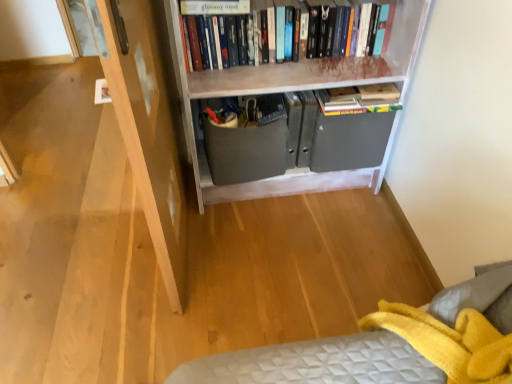
This screenshot has height=384, width=512. What are the coordinates of `hardcover book at upper center` in the screenshot? It's located at (214, 7).

Find the location of a particular element. hardcover books at upper center is located at coordinates (237, 34).

The width and height of the screenshot is (512, 384). What do you see at coordinates (237, 34) in the screenshot? I see `hardcover books at upper center` at bounding box center [237, 34].

What is the approximate width of white painted wood bookcase at upper center?

15.35 inches.

At what (x,y) coordinates should I click in order to perform the action: click on matte gray drawer at center. Please return your answer as a coordinate pair (x, y). Looking at the image, I should click on (244, 151).

At what (x,y) coordinates should I click in order to perform the action: click on hardcover book at upper center. Please return your answer as a coordinate pair (x, y). This screenshot has height=384, width=512. Looking at the image, I should click on (214, 7).

Between hardcover book at upper center and hardcover books at upper center, which one has more height?

Standing taller between the two is hardcover books at upper center.

Is the depth of hardcover book at upper center greater than that of hardcover books at upper center?

No, it is in front of hardcover books at upper center.

Is hardcover book at upper center looking in the opposite direction of hardcover books at upper center?

hardcover book at upper center is not turned away from hardcover books at upper center.

What's the angular difference between hardcover book at upper center and hardcover books at upper center's facing directions?

The angle between the facing direction of hardcover book at upper center and the facing direction of hardcover books at upper center is 0.000112 degrees.

In the scene shown: Is matte gray drawer at center bigger than white painted wood bookcase at upper center?

Actually, matte gray drawer at center might be smaller than white painted wood bookcase at upper center.

Between matte gray drawer at center and white painted wood bookcase at upper center, which one has larger width?

white painted wood bookcase at upper center.

From the image's perspective, between matte gray drawer at center and white painted wood bookcase at upper center, which one is located above?

white painted wood bookcase at upper center appears higher in the image.

From the image's perspective, is hardcover books at upper center located above or below white painted wood bookcase at upper center?

Based on their image positions, hardcover books at upper center is located above white painted wood bookcase at upper center.

Relative to white painted wood bookcase at upper center, is hardcover books at upper center in front or behind?

hardcover books at upper center is positioned farther from the viewer than white painted wood bookcase at upper center.

Is hardcover books at upper center facing towards white painted wood bookcase at upper center?

Yes, hardcover books at upper center faces towards white painted wood bookcase at upper center.

Is hardcover books at upper center in contact with white painted wood bookcase at upper center?

No.

Is point (313, 17) closer to viewer compared to point (236, 2)?

No, (313, 17) is further to viewer.

The width and height of the screenshot is (512, 384). Find the location of `paperback book to the left of hardcover books at upper center`. paperback book to the left of hardcover books at upper center is located at coordinates (214, 7).

Considering the relative sizes of hardcover books at upper center and hardcover book at upper center in the image provided, is hardcover books at upper center shorter than hardcover book at upper center?

Incorrect, the height of hardcover books at upper center does not fall short of that of hardcover book at upper center.

Considering the relative positions of matte gray drawer at center and hardcover books at upper center in the image provided, is matte gray drawer at center to the left or to the right of hardcover books at upper center?

matte gray drawer at center is positioned on hardcover books at upper center's left side.

Is matte gray drawer at center situated inside hardcover books at upper center or outside?

matte gray drawer at center is outside hardcover books at upper center.

Is matte gray drawer at center oriented towards hardcover books at upper center?

No, matte gray drawer at center is not oriented towards hardcover books at upper center.

Can you tell me how much matte gray drawer at center and hardcover books at upper center differ in facing direction?

The facing directions of matte gray drawer at center and hardcover books at upper center are 2.4 degrees apart.

Is point (406, 65) farther from camera compared to point (210, 35)?

Yes, it is.

From a real-world perspective, who is located higher, white painted wood bookcase at upper center or hardcover books at upper center?

In real-world perspective, hardcover books at upper center is above.

From the image's perspective, is white painted wood bookcase at upper center positioned above or below hardcover books at upper center?

Based on their image positions, white painted wood bookcase at upper center is located beneath hardcover books at upper center.

Can you see hardcover book at upper center touching matte gray drawer at center?

hardcover book at upper center is not next to matte gray drawer at center, and they're not touching.

From a real-world perspective, which object rests below the other?

matte gray drawer at center is physically lower.

Locate an element on the screen. This screenshot has height=384, width=512. drawer that appears below the hardcover book at upper center (from a real-world perspective) is located at coordinates (244, 151).

Between hardcover book at upper center and matte gray drawer at center, which one has larger size?

matte gray drawer at center.

What are the coordinates of `paperback book above the hardcover books at upper center (from a real-world perspective)` in the screenshot? It's located at (214, 7).

Locate an element on the screen. drawer lying below the white painted wood bookcase at upper center (from the image's perspective) is located at coordinates (244, 151).

Based on their spatial positions, is hardcover books at upper center or matte gray drawer at center closer to hardcover book at upper center?

Among the two, hardcover books at upper center is located nearer to hardcover book at upper center.

Based on the photo, which object lies further to the anchor point hardcover book at upper center, white painted wood bookcase at upper center or matte gray drawer at center?

matte gray drawer at center.

Based on their spatial positions, is matte gray drawer at center or hardcover books at upper center further from hardcover book at upper center?

Based on the image, matte gray drawer at center appears to be further to hardcover book at upper center.

When comparing their distances from hardcover book at upper center, does white painted wood bookcase at upper center or hardcover books at upper center seem further?

Among the two, white painted wood bookcase at upper center is located further to hardcover book at upper center.

Based on their spatial positions, is hardcover book at upper center or hardcover books at upper center closer to matte gray drawer at center?

hardcover books at upper center is positioned closer to the anchor matte gray drawer at center.

Based on their spatial positions, is white painted wood bookcase at upper center or hardcover book at upper center further from hardcover books at upper center?

The object further to hardcover books at upper center is hardcover book at upper center.

Based on their spatial positions, is hardcover book at upper center or matte gray drawer at center closer to white painted wood bookcase at upper center?

Based on the image, matte gray drawer at center appears to be nearer to white painted wood bookcase at upper center.

Based on their spatial positions, is matte gray drawer at center or hardcover book at upper center further from white painted wood bookcase at upper center?

hardcover book at upper center lies further to white painted wood bookcase at upper center than the other object.

This screenshot has width=512, height=384. Find the location of `book between hardcover book at upper center and matte gray drawer at center in the vertical direction`. book between hardcover book at upper center and matte gray drawer at center in the vertical direction is located at coordinates (237, 34).

You are a GUI agent. You are given a task and a screenshot of the screen. Output one action in this format:
    pyautogui.click(x=<x>, y=<y>)
    Task: Click on the bookcase between hardcover book at upper center and matte gray drawer at center vertically
    
    Given the screenshot: What is the action you would take?
    pyautogui.click(x=294, y=90)

Where is `bookcase between hardcover books at upper center and matte gray drawer at center vertically`? bookcase between hardcover books at upper center and matte gray drawer at center vertically is located at coordinates (294, 90).

I want to click on book between hardcover book at upper center and white painted wood bookcase at upper center in the horizontal direction, so (x=237, y=34).